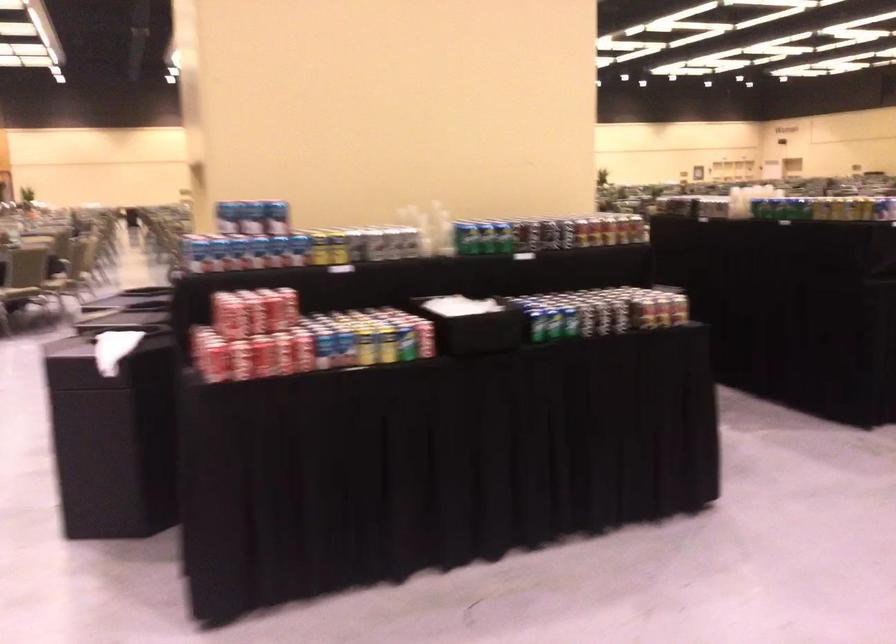
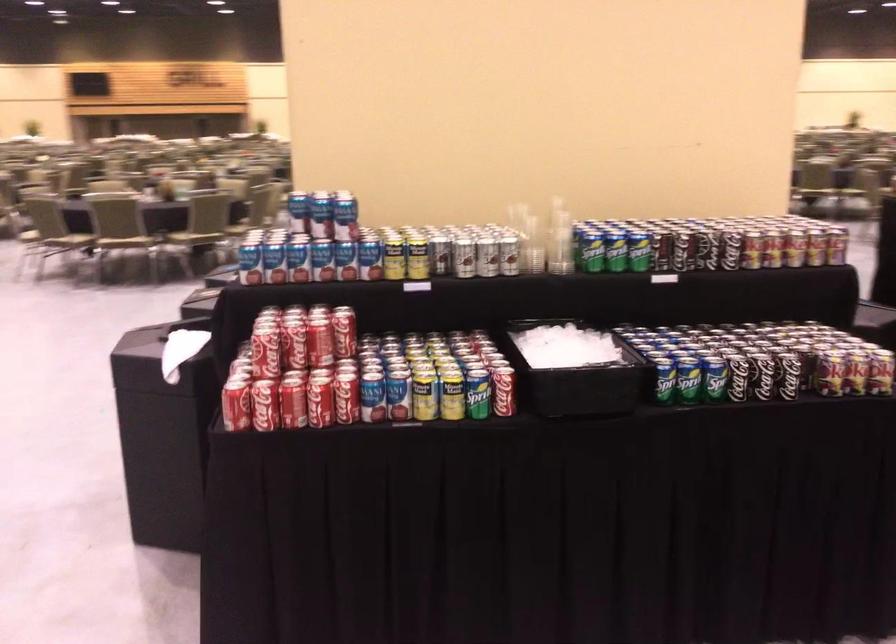
In a continuous first-person perspective shot, in which direction is the camera moving?

The movement direction of the cameraman is right, forward.